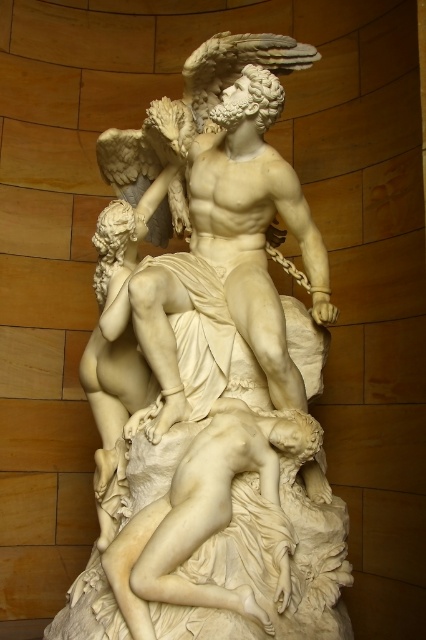
How distant is white marble sculpture at center from white marble nude at center?

They are 3.29 meters apart.

Can you confirm if white marble sculpture at center is wider than white marble nude at center?

Yes.

Does point (222, 182) come behind point (264, 484)?

Yes, point (222, 182) is farther from viewer.

I want to click on white marble sculpture at center, so click(207, 378).